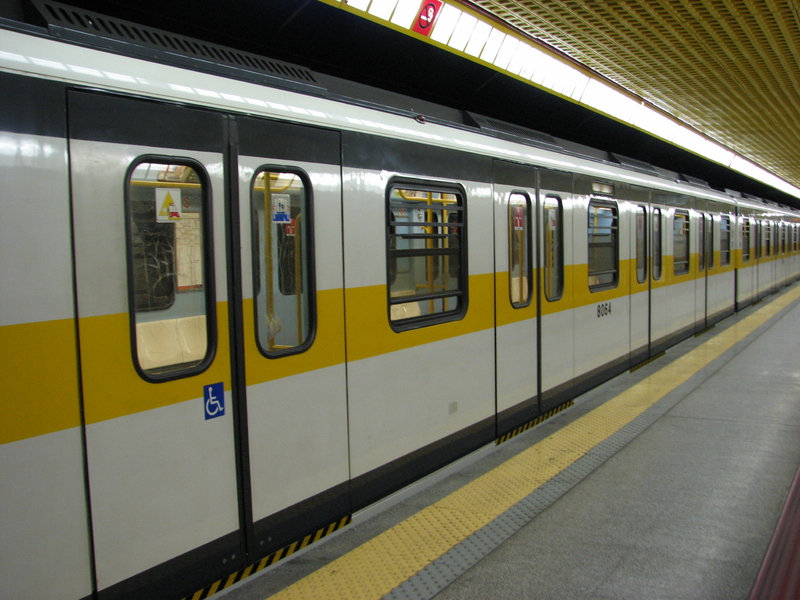
The width and height of the screenshot is (800, 600). I want to click on celing, so click(x=748, y=35).